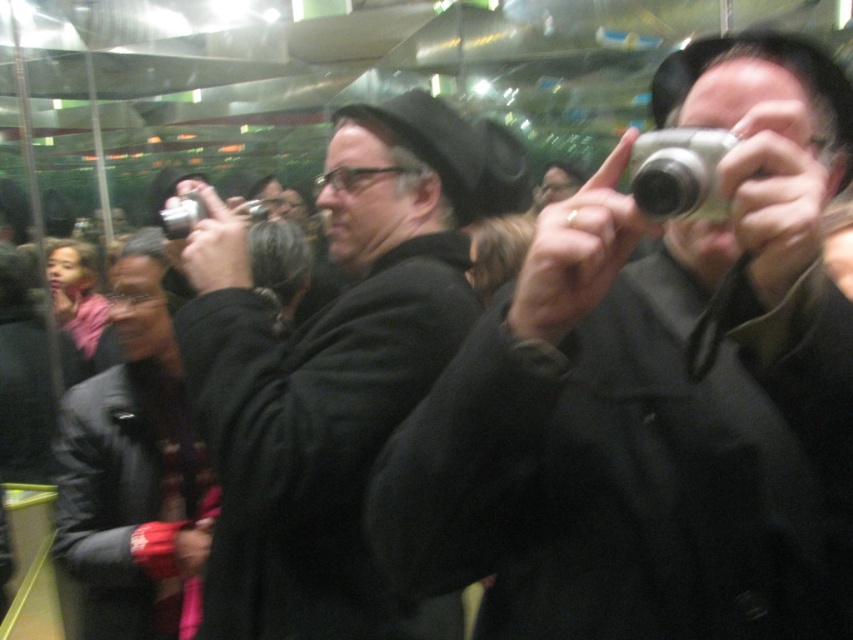
Is silver metallic camera at center taller than silver metallic camera at upper center?

Yes, silver metallic camera at center is taller than silver metallic camera at upper center.

Does silver metallic camera at center lie behind silver metallic camera at upper center?

That is False.

Image resolution: width=853 pixels, height=640 pixels. I want to click on silver metallic camera at center, so click(x=654, y=400).

Measure the distance between black matte coat at center and silver metallic camera at upper right.

black matte coat at center and silver metallic camera at upper right are 20.59 inches apart from each other.

Which of these two, black matte coat at center or silver metallic camera at upper right, stands shorter?

With less height is silver metallic camera at upper right.

Who is more forward, (281, 566) or (630, 173)?

Point (630, 173) is more forward.

Locate an element on the screen. Image resolution: width=853 pixels, height=640 pixels. black matte coat at center is located at coordinates (335, 368).

Between black leather jacket at center and silver metallic camera at upper right, which one is positioned higher?

Positioned higher is silver metallic camera at upper right.

Can you confirm if black leather jacket at center is taller than silver metallic camera at upper right?

Correct, black leather jacket at center is much taller as silver metallic camera at upper right.

Describe the element at coordinates (134, 470) in the screenshot. The height and width of the screenshot is (640, 853). I see `black leather jacket at center` at that location.

Find the location of a particular element. black leather jacket at center is located at coordinates (134, 470).